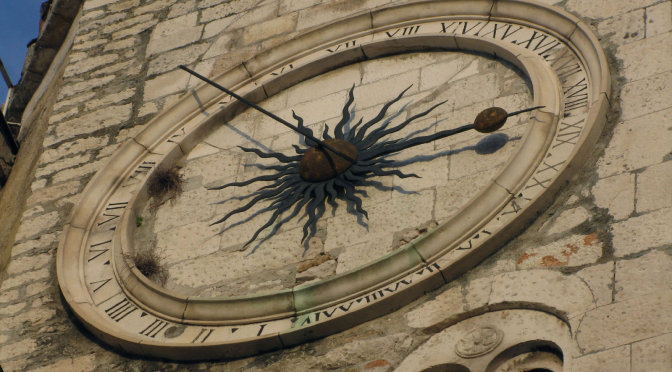
This screenshot has width=672, height=372. Identify the location of clock. (409, 196).